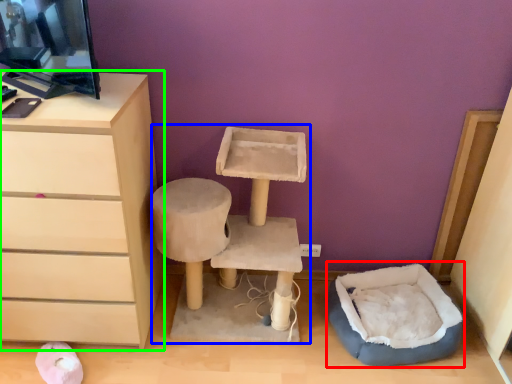
Question: Which is farther away from bean bag chair (highlighted by a red box)? vanity (highlighted by a blue box) or chest of drawers (highlighted by a green box)?

Choices:
 (A) vanity
 (B) chest of drawers

Answer: (B)